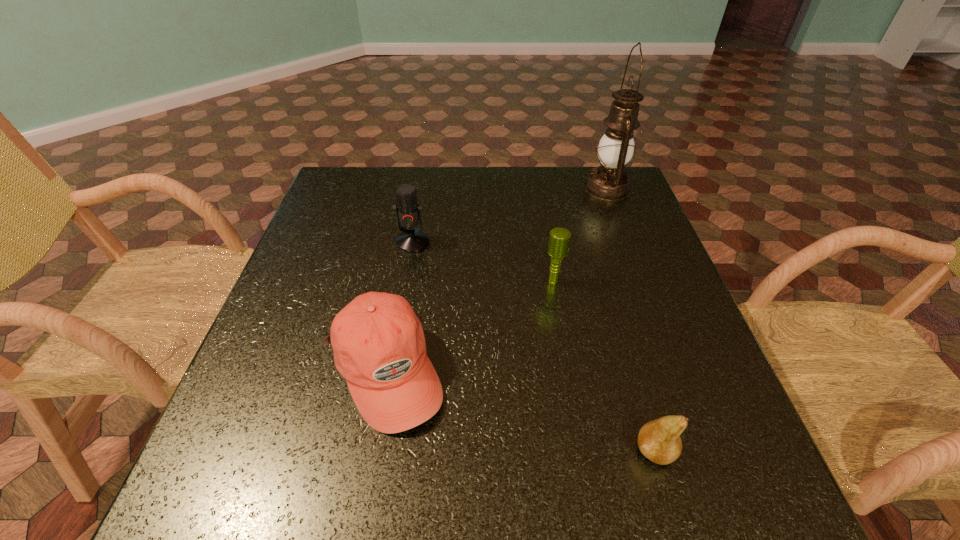
Image resolution: width=960 pixels, height=540 pixels. In order to click on free spot between the nearer microphone and the baseball cap in this screenshot , I will do `click(469, 326)`.

The image size is (960, 540). In order to click on empty location between the nearer microphone and the pear in this screenshot , I will do `click(604, 366)`.

The height and width of the screenshot is (540, 960). Find the location of `free space between the fourth nearest object and the oil lamp`. free space between the fourth nearest object and the oil lamp is located at coordinates (510, 215).

At what (x,y) coordinates should I click in order to perform the action: click on empty location between the oil lamp and the pear. Please return your answer as a coordinate pair (x, y). Looking at the image, I should click on (631, 320).

Identify the location of free space between the farthest object and the baseball cap. Image resolution: width=960 pixels, height=540 pixels. (496, 280).

At what (x,y) coordinates should I click in order to perform the action: click on object that stands as the fourth closest to the shortest object. Please return your answer as a coordinate pair (x, y). The image size is (960, 540). Looking at the image, I should click on (609, 182).

Find the location of `object that can be found as the second closest to the baseball cap`. object that can be found as the second closest to the baseball cap is located at coordinates (559, 239).

Find the location of a particular element. Image resolution: width=960 pixels, height=540 pixels. blank space that satisfies the following two spatial constraints: 1. on the side of the pear with the red ring; 2. on the right side of the second farthest object is located at coordinates 377,451.

Find the location of a particular element. The width and height of the screenshot is (960, 540). vacant space that satisfies the following two spatial constraints: 1. on the side of the farther microphone with the red ring; 2. on the right side of the pear is located at coordinates point(377,451).